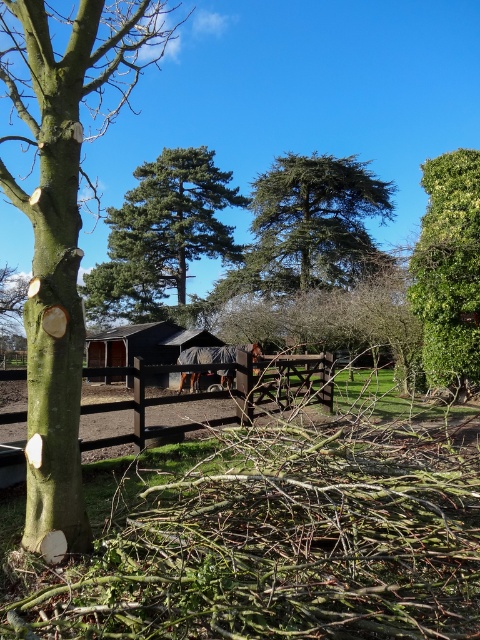
Is green textured pine tree at center closer to the viewer compared to brown wooden fence at center?

No, it is behind brown wooden fence at center.

Does green textured pine tree at center have a greater width compared to brown wooden fence at center?

Correct, the width of green textured pine tree at center exceeds that of brown wooden fence at center.

Is point (159, 250) in front of point (105, 445)?

No.

The height and width of the screenshot is (640, 480). Identify the location of green textured pine tree at center. (162, 236).

Is brown wooden fence at center further to camera compared to dark gray fabric horse at center?

No, brown wooden fence at center is in front of dark gray fabric horse at center.

Locate an element on the screen. brown wooden fence at center is located at coordinates (225, 394).

Locate an element on the screen. The height and width of the screenshot is (640, 480). brown wooden fence at center is located at coordinates (225, 394).

Locate an element on the screen. brown wooden fence at center is located at coordinates (225, 394).

What do you see at coordinates (63, 214) in the screenshot? This screenshot has width=480, height=640. I see `green rough bark tree at left` at bounding box center [63, 214].

What are the coordinates of `green rough bark tree at left` in the screenshot? It's located at (63, 214).